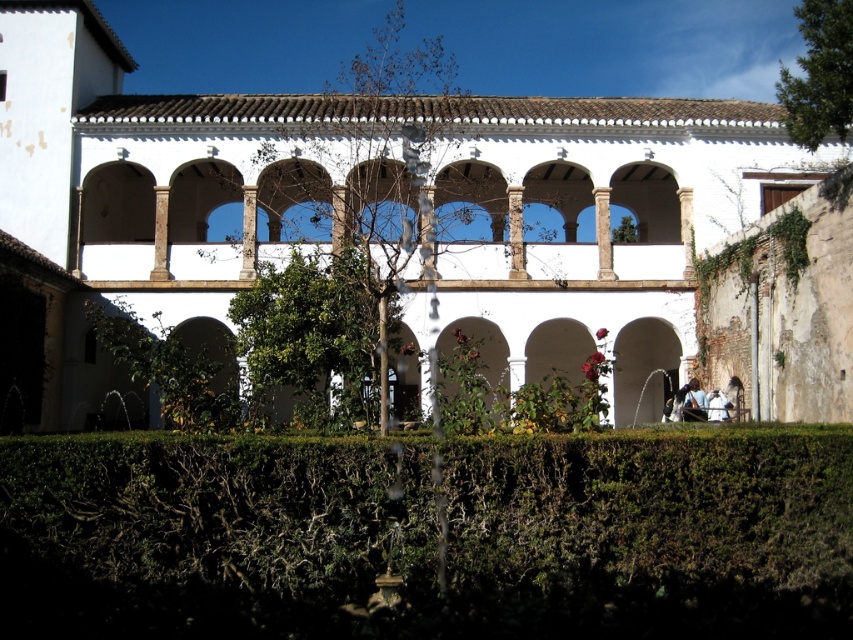
Consider the image. You are an architect visiting the courtyard and want to take a photo that includes both the white stone building at center and the green stone archway at center. Given their sizes, which object should you frame first to ensure both fit in the photo?

The white stone building at center is larger in size than the green stone archway at center, so you should frame the white stone building at center first to ensure both fit in the photo since it takes up more space.